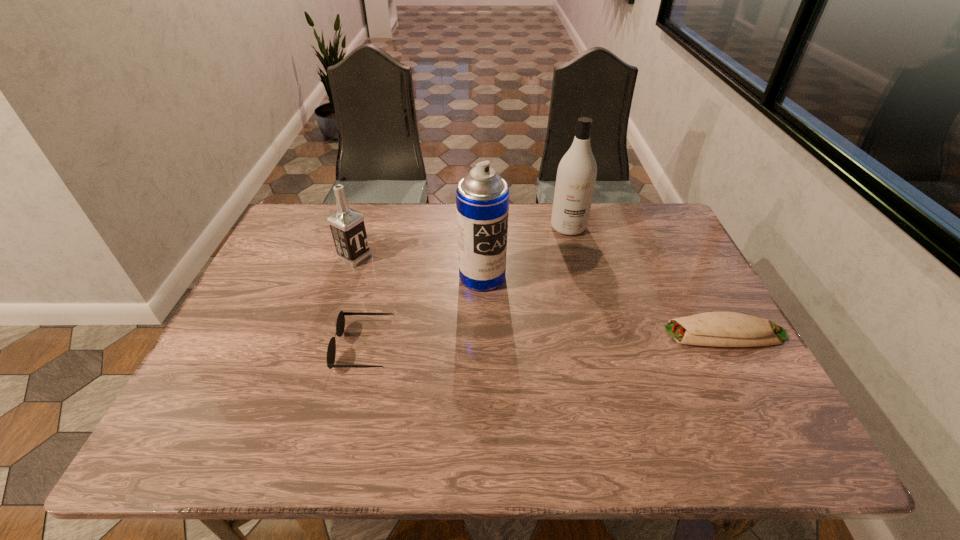
Image resolution: width=960 pixels, height=540 pixels. In order to click on the second shortest object in this screenshot , I will do `click(340, 324)`.

The height and width of the screenshot is (540, 960). Find the location of `the shortest object`. the shortest object is located at coordinates (720, 329).

At what (x,y) coordinates should I click in order to perform the action: click on burrito. Please return your answer as a coordinate pair (x, y). The height and width of the screenshot is (540, 960). Looking at the image, I should click on (720, 329).

The image size is (960, 540). I want to click on vodka, so click(x=347, y=226).

Where is `the third object from right to left`? The width and height of the screenshot is (960, 540). the third object from right to left is located at coordinates (482, 197).

You are a GUI agent. You are given a task and a screenshot of the screen. Output one action in this format:
    pyautogui.click(x=<x>, y=<y>)
    Task: Click on the shampoo
    This screenshot has height=540, width=960.
    Given the screenshot: What is the action you would take?
    pyautogui.click(x=576, y=176)

Identify the location of the fourth object from left to right. Image resolution: width=960 pixels, height=540 pixels. (576, 176).

At what (x,y) coordinates should I click in order to perform the action: click on vacant space located on the front-facing side of the second shortest object. Please return your answer as a coordinate pair (x, y). Looking at the image, I should click on pos(267,348).

Locate an element on the screen. The height and width of the screenshot is (540, 960). vacant space located 0.200m on the front-facing side of the second shortest object is located at coordinates (254, 348).

Where is `vacant space located 0.240m on the front-facing side of the second shortest object`? The image size is (960, 540). vacant space located 0.240m on the front-facing side of the second shortest object is located at coordinates click(x=238, y=348).